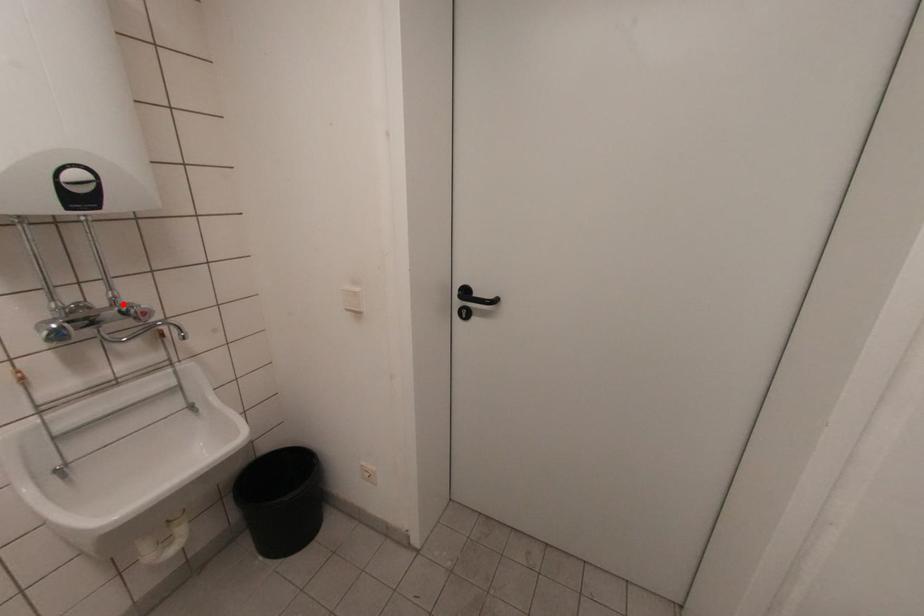
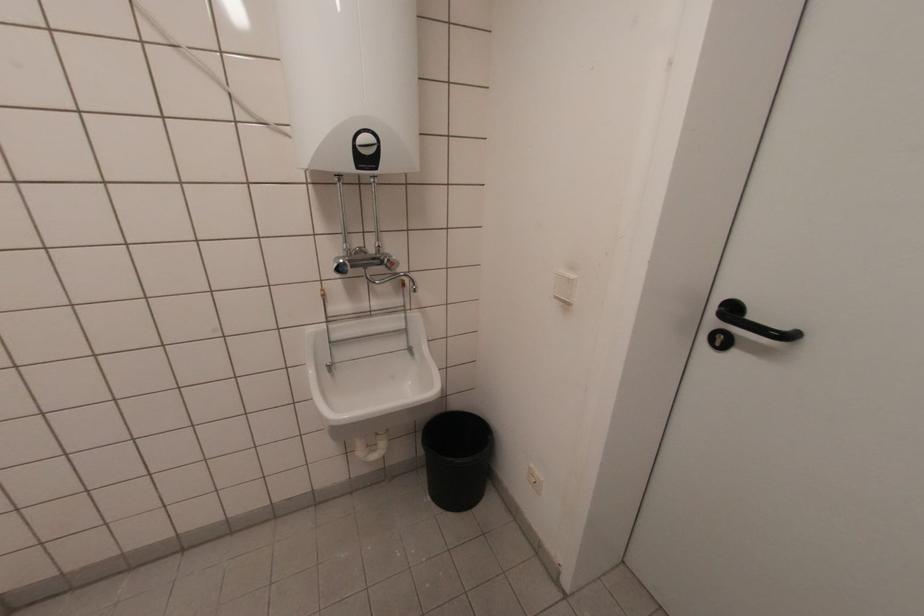
In the second image, find the point that corresponds to the highlighted location in the first image.

(383, 254)